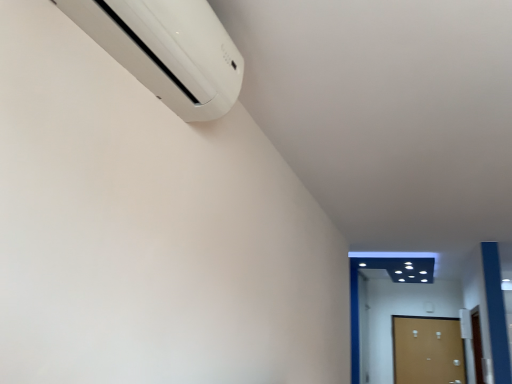
Question: Looking at their shapes, would you say brown matte door at lower right, which appears as the 1th door when viewed from the right, is wider or thinner than white plastic air conditioner at upper left?

Choices:
 (A) thin
 (B) wide

Answer: (A)

Question: Would you say brown matte door at lower right, which appears as the 1th door when viewed from the right, is inside or outside white plastic air conditioner at upper left?

Choices:
 (A) outside
 (B) inside

Answer: (A)

Question: Based on their relative distances, which object is nearer to the white plastic air conditioner at upper left?

Choices:
 (A) wooden door at lower right, which ranks as the first door in left-to-right order
 (B) brown matte door at lower right, which appears as the 1th door when viewed from the right

Answer: (A)

Question: Which object is positioned farthest from the white plastic air conditioner at upper left?

Choices:
 (A) wooden door at lower right, which ranks as the first door in left-to-right order
 (B) brown matte door at lower right, marked as the 2th door in a left-to-right arrangement

Answer: (B)